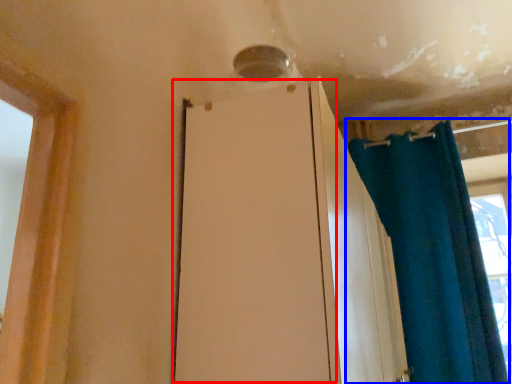
Question: Which of the following is the closest to the observer, screen door (highlighted by a red box) or curtain (highlighted by a blue box)?

Choices:
 (A) screen door
 (B) curtain

Answer: (A)